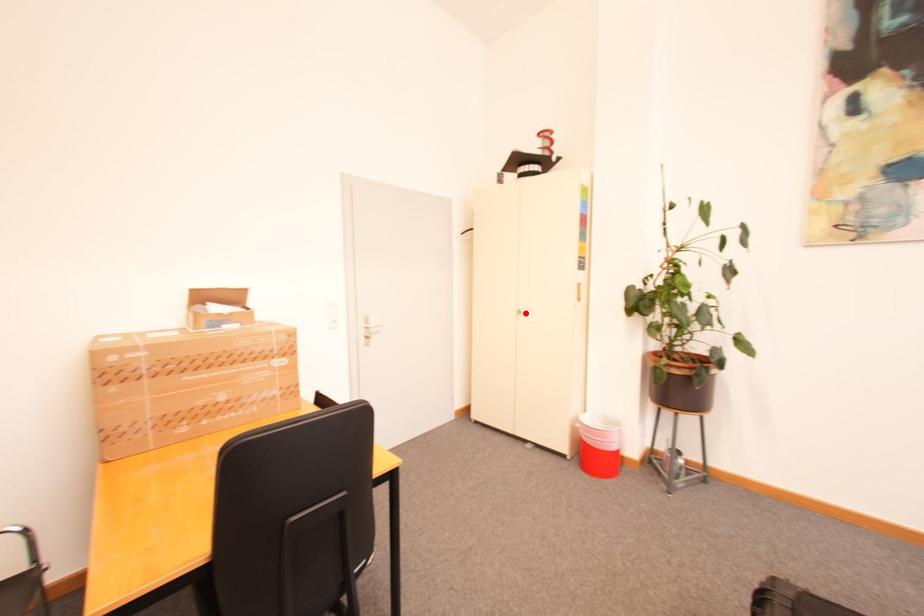
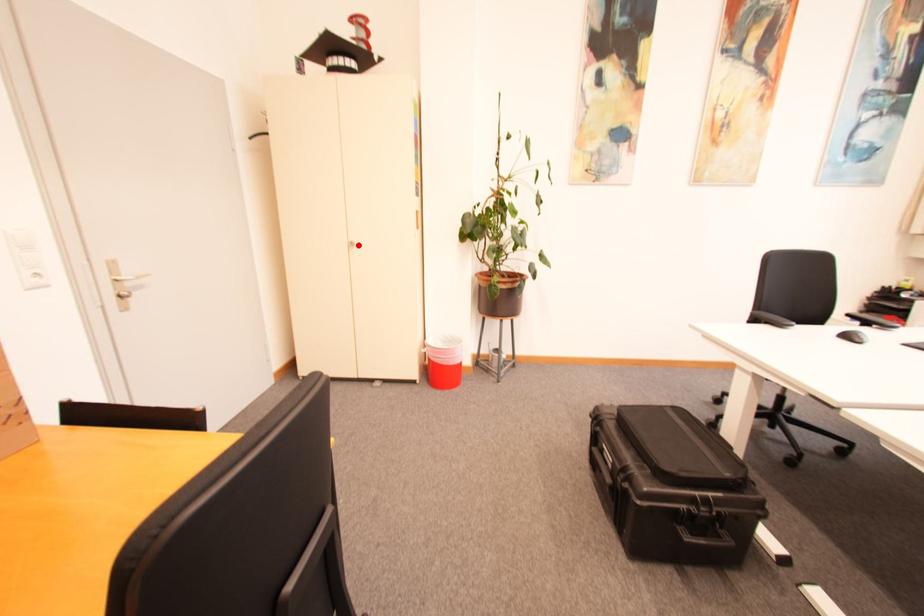
I am providing you with two images of the same scene from different viewpoints. A red point is marked on the first image and another point is marked on the second image. Do the highlighted points in image1 and image2 indicate the same real-world spot?

Yes